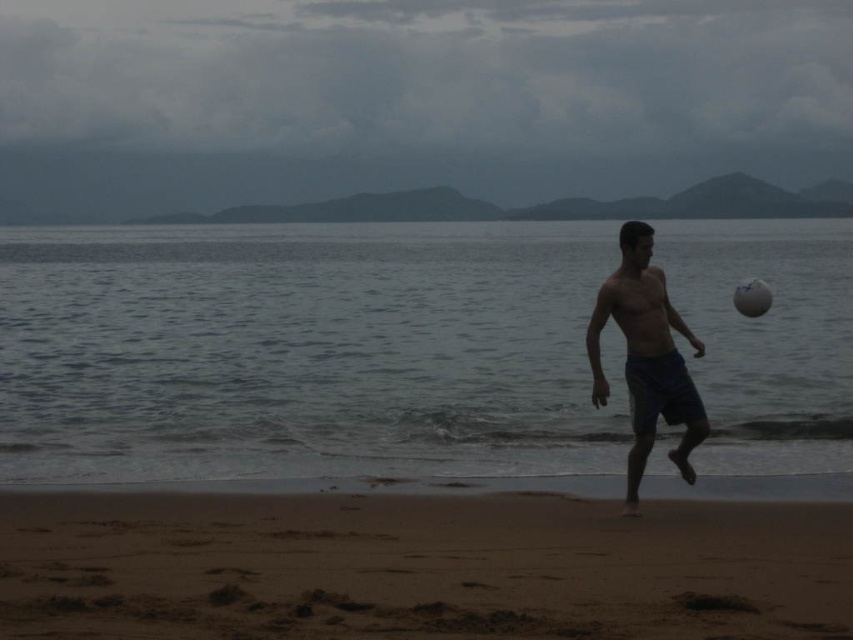
You are standing on the brown sandy beach at lower center and want to reach the clear water at lower center. Which direction should you move towards?

You should move towards the direction of the clear water at lower center since it is located above the brown sandy beach at lower center.

You are standing at the center of the beach and want to find the clear water at lower center. According to the coordinates provided, in which direction should you move to reach it?

The clear water at lower center is located at coordinates point [305,353]. Since you are at the center of the beach, you should move slightly to the right and forward to reach it.

From the picture: You are standing on the brown sandy beach at lower center and want to walk to the clear water at lower center. Based on the scene description, which direction should you move to reach the water?

The clear water at lower center has a greater height compared to the brown sandy beach at lower center, so you should move towards the higher elevation to reach the clear water at lower center.